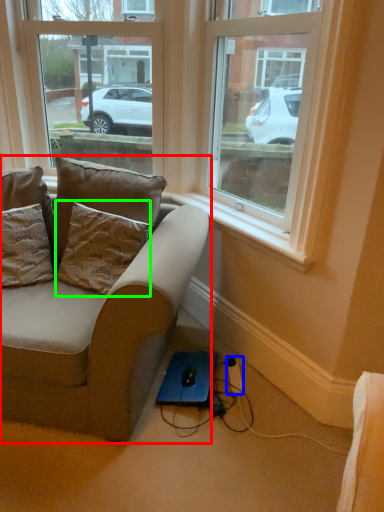
Question: Which object is positioned farthest from studio couch (highlighted by a red box)? Select from extension cord (highlighted by a blue box) and pillow (highlighted by a green box).

Choices:
 (A) extension cord
 (B) pillow

Answer: (A)